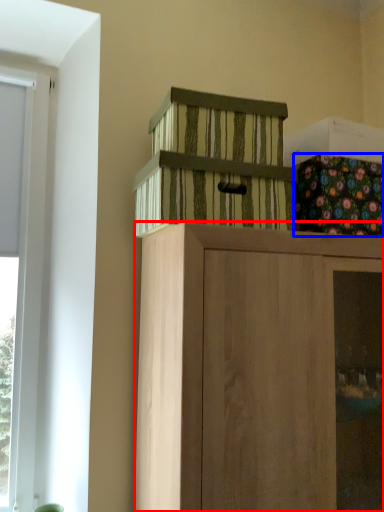
Question: Which point is closer to the camera, cabinetry (highlighted by a red box) or flower (highlighted by a blue box)?

Choices:
 (A) cabinetry
 (B) flower

Answer: (A)